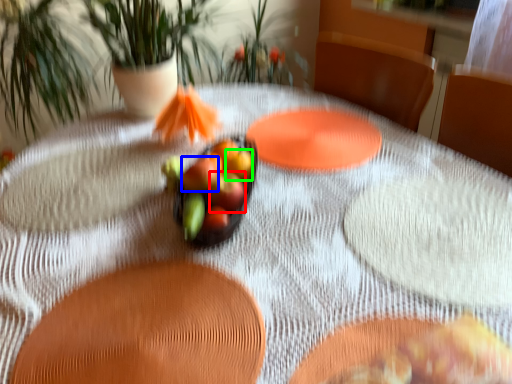
Question: Which is farther away from apple (highlighted by a red box)? flower (highlighted by a blue box) or apple (highlighted by a green box)?

Choices:
 (A) flower
 (B) apple

Answer: (B)